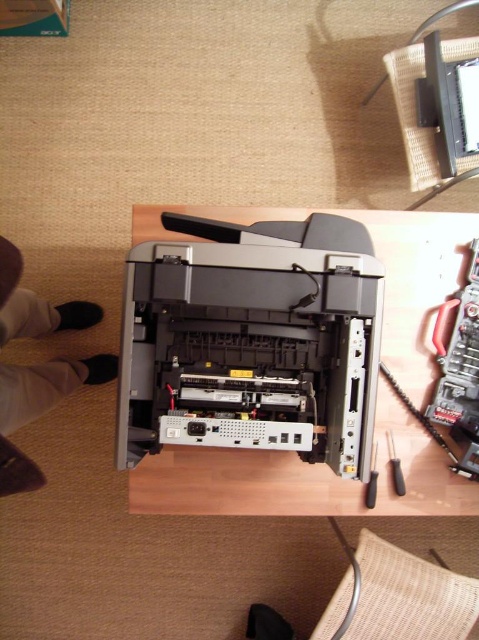
Which is in front, point (9, 456) or point (398, 488)?

Point (9, 456)

Between point (50, 310) and point (392, 454), which one is positioned behind?

The point (50, 310) is more distant.

What do you see at coordinates (38, 408) in the screenshot? I see `white fabric pants at lower left` at bounding box center [38, 408].

The image size is (479, 640). What are the coordinates of `white fabric pants at lower left` in the screenshot? It's located at (38, 408).

You are a GUI agent. You are given a task and a screenshot of the screen. Output one action in this format:
    pyautogui.click(x=<x>, y=<y>)
    Task: Click on the white fabric pants at lower left
    The height and width of the screenshot is (640, 479).
    Given the screenshot: What is the action you would take?
    pyautogui.click(x=38, y=408)

Looking at this image, who is more forward, (x=24, y=332) or (x=374, y=458)?

Positioned in front is point (x=374, y=458).

At what (x,y) coordinates should I click in order to perform the action: click on white fabric pants at lower left. Please return your answer as a coordinate pair (x, y). This screenshot has height=640, width=479. Looking at the image, I should click on (38, 408).

Is black plastic printer at center positioned at the back of white fabric pants at lower left?

That is False.

Does black plastic printer at center have a smaller size compared to white fabric pants at lower left?

Yes, black plastic printer at center is smaller than white fabric pants at lower left.

I want to click on black plastic printer at center, so click(x=252, y=340).